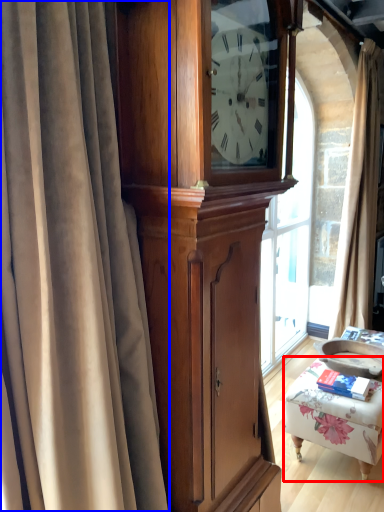
Question: Which object is closer to the camera taking this photo, furniture (highlighted by a red box) or curtain (highlighted by a blue box)?

Choices:
 (A) furniture
 (B) curtain

Answer: (B)